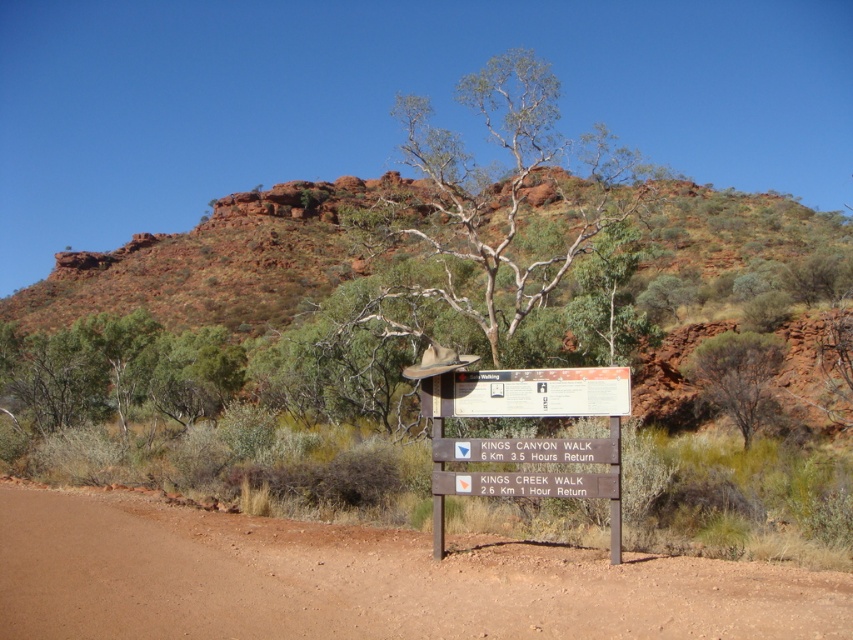
Which is more to the left, reddish-brown rock at center or wooden sign at center?

wooden sign at center

Does reddish-brown rock at center have a greater width compared to wooden sign at center?

Correct, the width of reddish-brown rock at center exceeds that of wooden sign at center.

Where is `reddish-brown rock at center`? This screenshot has width=853, height=640. reddish-brown rock at center is located at coordinates (410, 291).

This screenshot has width=853, height=640. Identify the location of reddish-brown rock at center. (410, 291).

Who is more forward, [830,611] or [590,449]?

Positioned in front is point [830,611].

What do you see at coordinates (364, 580) in the screenshot? The image size is (853, 640). I see `brown dirt track at center` at bounding box center [364, 580].

I want to click on brown dirt track at center, so click(x=364, y=580).

Is wooden signboard at center to the left of green leafy tree at center from the viewer's perspective?

Correct, you'll find wooden signboard at center to the left of green leafy tree at center.

Between point (618, 380) and point (743, 365), which one is positioned in front?

Point (618, 380) is more forward.

I want to click on wooden signboard at center, so click(x=527, y=392).